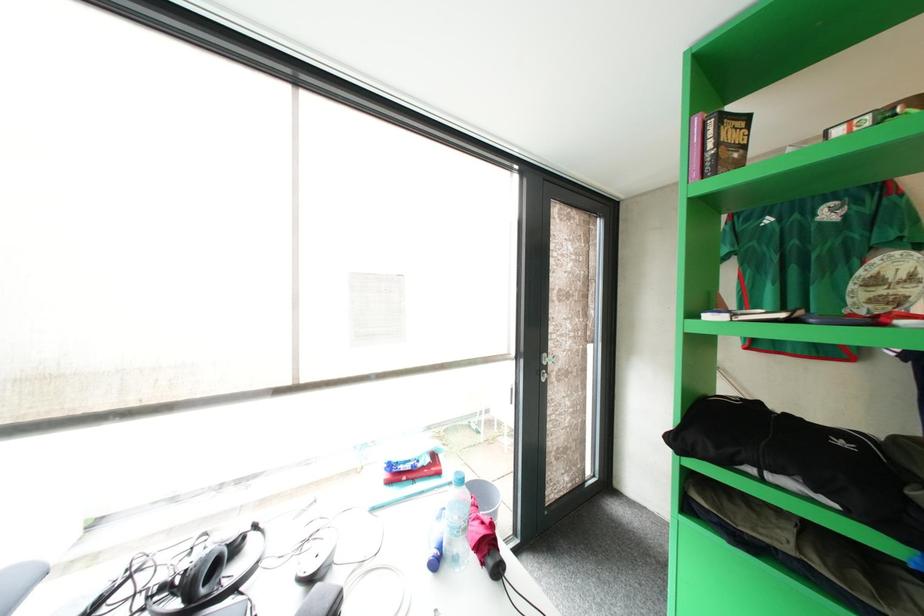
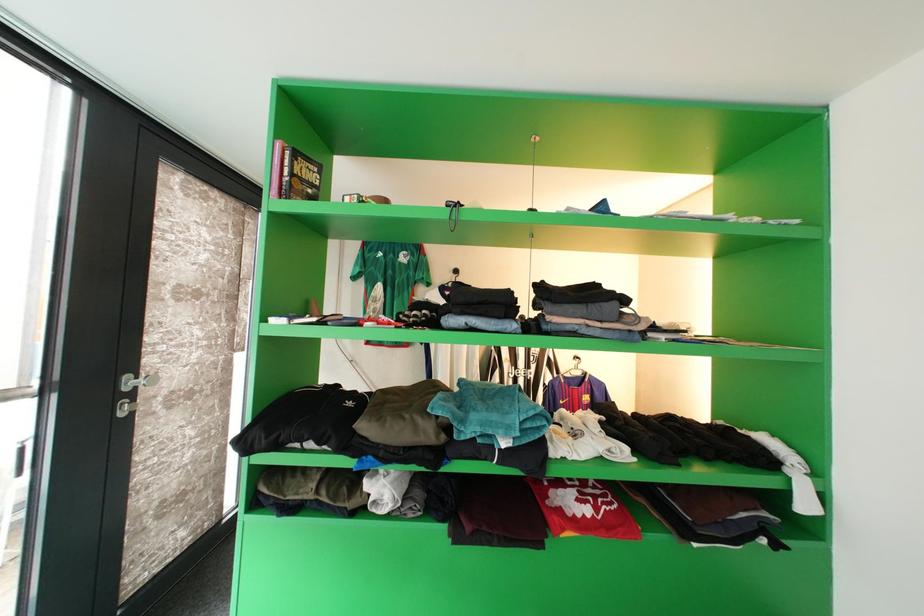
Question: The camera is either moving clockwise (left) or counter-clockwise (right) around the object. The first image is from the beginning of the video and the second image is from the end. Is the camera moving left or right when shooting the video?

Choices:
 (A) Left
 (B) Right

Answer: (A)